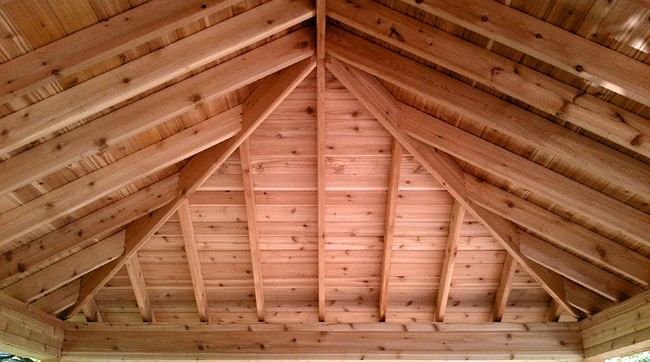
You are a GUI agent. You are given a task and a screenshot of the screen. Output one action in this format:
    pyautogui.click(x=<x>, y=<y>)
    Task: Click on the beam in center of image
    The height and width of the screenshot is (362, 650).
    Given the screenshot: What is the action you would take?
    pyautogui.click(x=320, y=156)